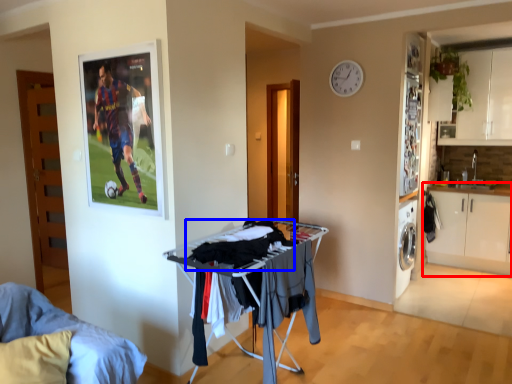
Question: Which object appears closest to the camera in this image, cabinetry (highlighted by a red box) or laundry (highlighted by a blue box)?

Choices:
 (A) cabinetry
 (B) laundry

Answer: (B)